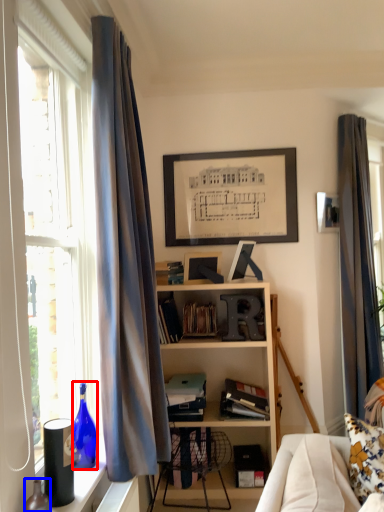
Question: Which of the following is the closest to the observer, bottle (highlighted by a red box) or bottle (highlighted by a blue box)?

Choices:
 (A) bottle
 (B) bottle

Answer: (B)